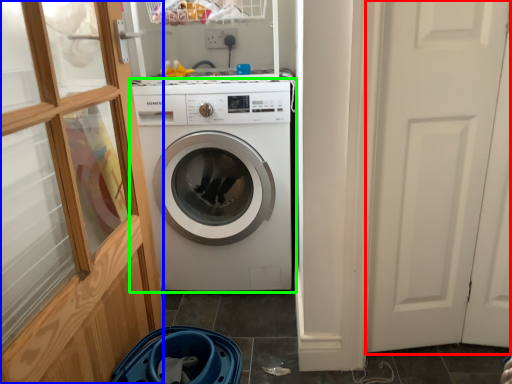
Question: Estimate the real-world distances between objects in this image. Which object is closer to screen door (highlighted by a red box), glass door (highlighted by a blue box) or washing machine (highlighted by a green box)?

Choices:
 (A) glass door
 (B) washing machine

Answer: (B)